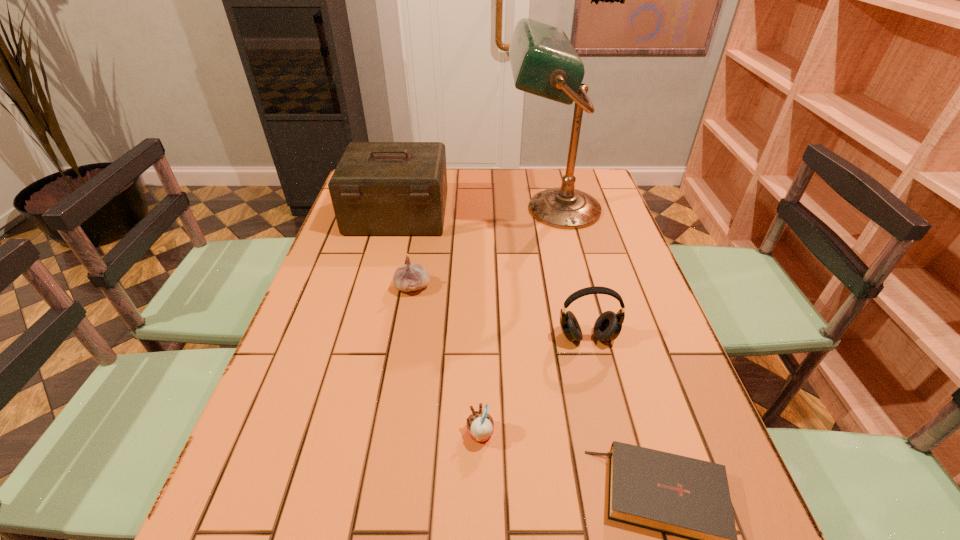
You are a GUI agent. You are given a task and a screenshot of the screen. Output one action in this format:
    pyautogui.click(x=<x>, y=<y>)
    Task: Click on the table lamp that is positioned at the right edge
    
    Given the screenshot: What is the action you would take?
    pyautogui.click(x=544, y=62)

This screenshot has width=960, height=540. In order to click on headset situated at the right edge in this screenshot , I will do `click(608, 325)`.

Image resolution: width=960 pixels, height=540 pixels. In order to click on object present at the far left corner in this screenshot , I will do `click(378, 188)`.

Image resolution: width=960 pixels, height=540 pixels. Identify the location of object positioned at the far right corner. (544, 62).

You are a GUI agent. You are given a task and a screenshot of the screen. Output one action in this format:
    pyautogui.click(x=<x>, y=<y>)
    Task: Click on the vacant area at the far edge
    
    Given the screenshot: What is the action you would take?
    pyautogui.click(x=527, y=173)

You are a GUI agent. You are given a task and a screenshot of the screen. Output one action in this format:
    pyautogui.click(x=<x>, y=<y>)
    Task: Click on the vacant space at the left edge of the desktop
    The image size is (960, 540).
    Given the screenshot: What is the action you would take?
    pyautogui.click(x=313, y=318)

This screenshot has height=540, width=960. What are the coordinates of `blank space at the right edge of the desktop` in the screenshot? It's located at (660, 390).

Image resolution: width=960 pixels, height=540 pixels. In the image, there is a desktop. In order to click on vacant space at the far right corner in this screenshot , I will do `click(592, 170)`.

Find the location of a particular element. This screenshot has width=960, height=540. blank region between the table lamp and the first-aid kit is located at coordinates (475, 212).

Locate an element on the screen. free point between the third tallest object and the fourth tallest object is located at coordinates (500, 312).